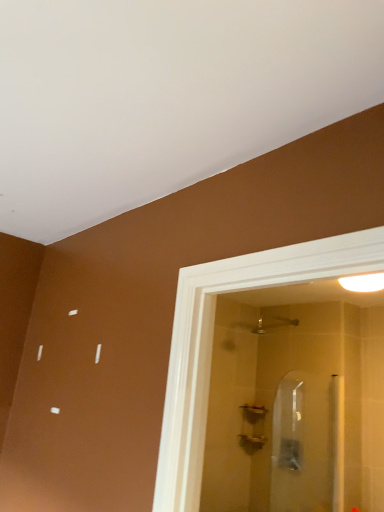
Measure the distance between clear glass screen door at center and camera.

clear glass screen door at center is 2.57 meters from camera.

Locate an element on the screen. white glossy light fixture at upper right is located at coordinates (363, 283).

Where is `matte silver showerhead at upper center`? matte silver showerhead at upper center is located at coordinates point(272,324).

Which object is more forward, white glossy light fixture at upper right or matte silver showerhead at upper center?

white glossy light fixture at upper right is closer to the camera.

Would you consider white glossy light fixture at upper right to be distant from matte silver showerhead at upper center?

white glossy light fixture at upper right is near matte silver showerhead at upper center, not far away.

Looking at this image, between white glossy light fixture at upper right and matte silver showerhead at upper center, which one appears on the left side from the viewer's perspective?

matte silver showerhead at upper center is more to the left.

From a real-world perspective, which object rests below the other?

A: In real-world perspective, matte silver showerhead at upper center is lower.

Find the location of `screen door that appears on the right of matte silver showerhead at upper center`. screen door that appears on the right of matte silver showerhead at upper center is located at coordinates click(x=306, y=444).

Which object is positioned more to the left, matte silver showerhead at upper center or clear glass screen door at center?

matte silver showerhead at upper center is more to the left.

Considering the relative sizes of matte silver showerhead at upper center and clear glass screen door at center in the image provided, is matte silver showerhead at upper center shorter than clear glass screen door at center?

Yes.

Is clear glass screen door at center shorter than matte silver showerhead at upper center?

No, clear glass screen door at center is not shorter than matte silver showerhead at upper center.

Is clear glass screen door at center facing away from matte silver showerhead at upper center?

No, clear glass screen door at center's orientation is not away from matte silver showerhead at upper center.

Between clear glass screen door at center and matte silver showerhead at upper center, which one appears on the left side from the viewer's perspective?

matte silver showerhead at upper center.

Which object is thinner, clear glass screen door at center or matte silver showerhead at upper center?

Thinner between the two is clear glass screen door at center.

Considering the positions of point (262, 324) and point (358, 278), is point (262, 324) closer or farther from the camera than point (358, 278)?

Point (262, 324) is farther from the camera than point (358, 278).

I want to click on light fixture lying on the right of matte silver showerhead at upper center, so click(x=363, y=283).

Is white glossy light fixture at upper right at the back of matte silver showerhead at upper center?

matte silver showerhead at upper center is not turned away from white glossy light fixture at upper right.

From the image's perspective, is clear glass screen door at center positioned above or below white glossy light fixture at upper right?

clear glass screen door at center is situated lower than white glossy light fixture at upper right in the image.

Is clear glass screen door at center facing towards white glossy light fixture at upper right?

No, clear glass screen door at center does not turn towards white glossy light fixture at upper right.

Considering the sizes of objects clear glass screen door at center and white glossy light fixture at upper right in the image provided, who is taller, clear glass screen door at center or white glossy light fixture at upper right?

With more height is clear glass screen door at center.

From a real-world perspective, which is physically below, white glossy light fixture at upper right or clear glass screen door at center?

From a 3D spatial view, clear glass screen door at center is below.

This screenshot has height=512, width=384. What are the coordinates of `screen door behind the white glossy light fixture at upper right` in the screenshot? It's located at (306, 444).

Based on the photo, is white glossy light fixture at upper right positioned with its back to clear glass screen door at center?

No, white glossy light fixture at upper right's orientation is not away from clear glass screen door at center.

The width and height of the screenshot is (384, 512). In the image, there is a matte silver showerhead at upper center. In order to click on light fixture above it (from the image's perspective) in this screenshot , I will do `click(363, 283)`.

The height and width of the screenshot is (512, 384). I want to click on screen door in front of the matte silver showerhead at upper center, so click(x=306, y=444).

Which object lies further to the anchor point matte silver showerhead at upper center, white glossy light fixture at upper right or clear glass screen door at center?

Based on the image, white glossy light fixture at upper right appears to be further to matte silver showerhead at upper center.

From the image, which object appears to be nearer to white glossy light fixture at upper right, clear glass screen door at center or matte silver showerhead at upper center?

matte silver showerhead at upper center lies closer to white glossy light fixture at upper right than the other object.

When comparing their distances from white glossy light fixture at upper right, does matte silver showerhead at upper center or clear glass screen door at center seem further?

clear glass screen door at center is further to white glossy light fixture at upper right.

Based on their spatial positions, is matte silver showerhead at upper center or white glossy light fixture at upper right closer to clear glass screen door at center?

Based on the image, matte silver showerhead at upper center appears to be nearer to clear glass screen door at center.

When comparing their distances from matte silver showerhead at upper center, does clear glass screen door at center or white glossy light fixture at upper right seem further?

Based on the image, white glossy light fixture at upper right appears to be further to matte silver showerhead at upper center.

From the image, which object appears to be farther from clear glass screen door at center, white glossy light fixture at upper right or matte silver showerhead at upper center?

white glossy light fixture at upper right is further to clear glass screen door at center.

Identify the location of shower that lies between white glossy light fixture at upper right and clear glass screen door at center from top to bottom. The width and height of the screenshot is (384, 512). (272, 324).